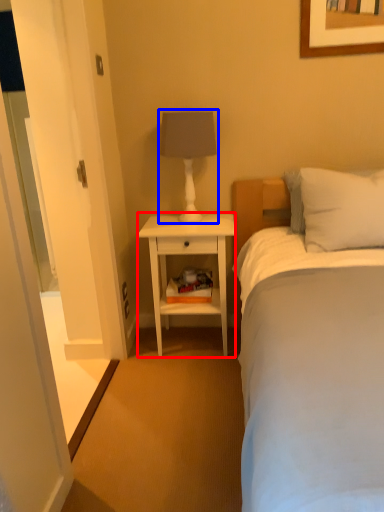
Question: Which object is closer to the camera taking this photo, nightstand (highlighted by a red box) or table lamp (highlighted by a blue box)?

Choices:
 (A) nightstand
 (B) table lamp

Answer: (B)